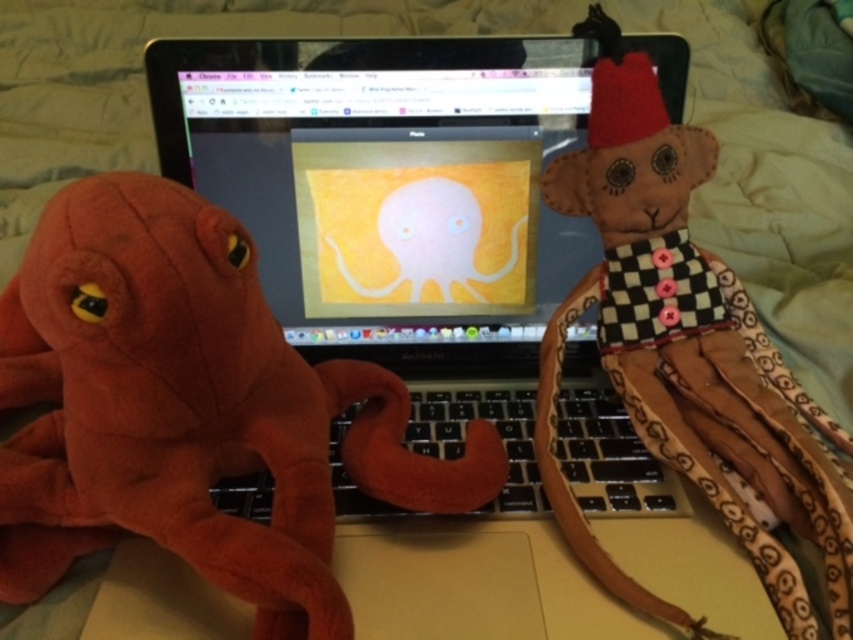
Question: Is matte plastic laptop at center below brown fabric monkey at right?

Choices:
 (A) yes
 (B) no

Answer: (B)

Question: Which point is farther to the camera?

Choices:
 (A) [x=428, y=211]
 (B) [x=234, y=544]

Answer: (A)

Question: Does soft plush octopus at left have a smaller size compared to brown fabric monkey at right?

Choices:
 (A) no
 (B) yes

Answer: (A)

Question: Which object is closer to the camera taking this photo?

Choices:
 (A) soft plush octopus at left
 (B) matte plastic laptop at center
 (C) brown fabric monkey at right

Answer: (A)

Question: Which of the following is the closest to the observer?

Choices:
 (A) soft plush octopus at left
 (B) brown fabric monkey at right

Answer: (A)

Question: Does soft plush octopus at left have a larger size compared to matte plastic laptop at center?

Choices:
 (A) yes
 (B) no

Answer: (A)